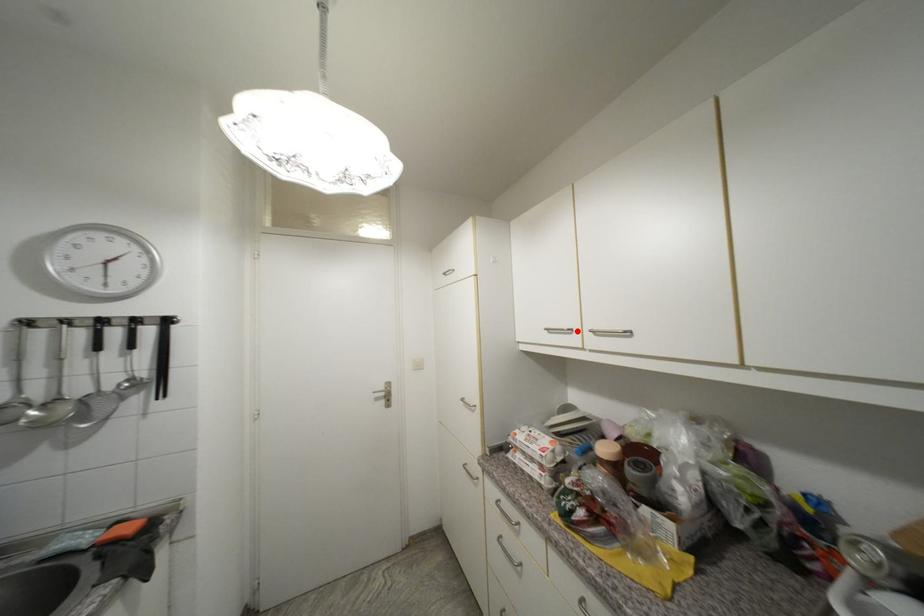
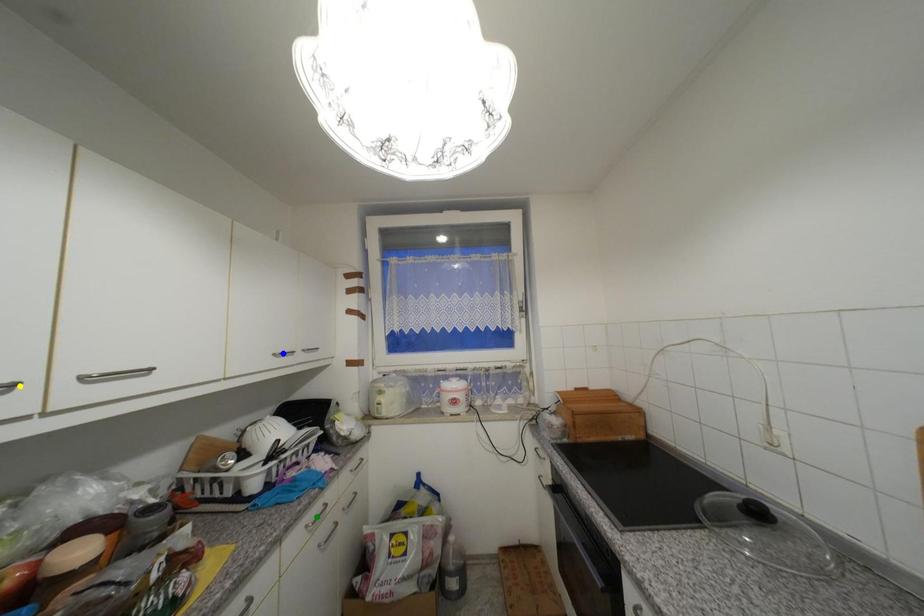
Question: I am providing you with two images of the same scene from different viewpoints. A red point is marked on the first image. You are given multiple points on the second image. Which point in image 2 represents the same 3d spot as the red point in image 1?

Choices:
 (A) yellow point
 (B) blue point
 (C) green point

Answer: (A)